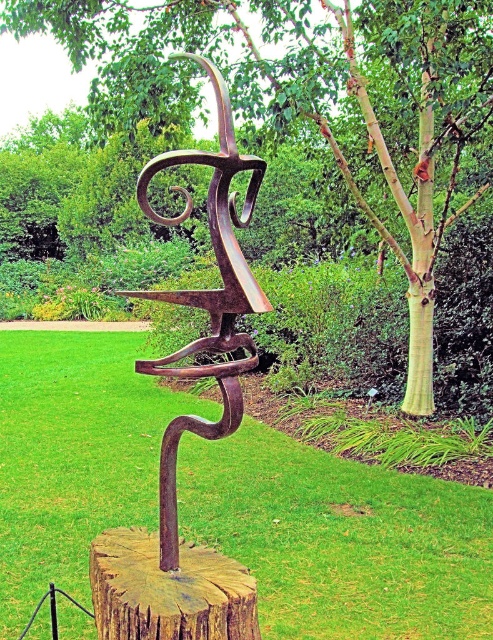
Question: Which point appears farthest from the camera in this image?

Choices:
 (A) (232, 268)
 (B) (101, 45)

Answer: (B)

Question: Is rusty metal sculpture at center positioned at the back of wooden stump at center?

Choices:
 (A) yes
 (B) no

Answer: (B)

Question: Can you confirm if green wood tree at center is wider than rusty metal sculpture at center?

Choices:
 (A) no
 (B) yes

Answer: (B)

Question: Which of the following is the closest to the observer?

Choices:
 (A) wooden stump at center
 (B) green wood tree at center
 (C) rusty metal sculpture at center

Answer: (C)

Question: Considering the real-world distances, which object is closest to the rusty metal sculpture at center?

Choices:
 (A) green wood tree at center
 (B) wooden stump at center

Answer: (B)

Question: Considering the relative positions of green wood tree at center and rusty metal sculpture at center in the image provided, where is green wood tree at center located with respect to rusty metal sculpture at center?

Choices:
 (A) right
 (B) left

Answer: (A)